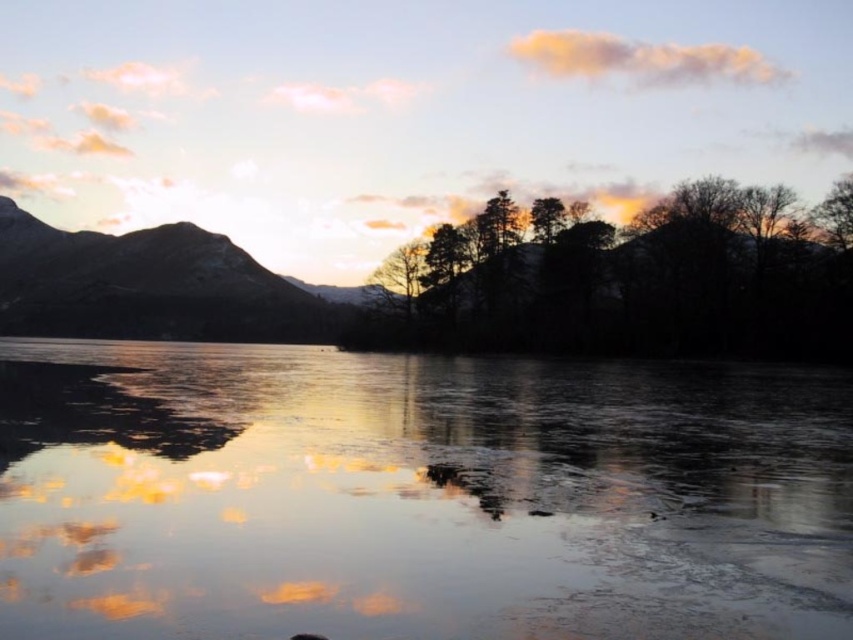
Question: Which of the following is the farthest from the observer?

Choices:
 (A) (845, 355)
 (B) (827, 212)
 (C) (53, 276)
 (D) (679, 572)

Answer: (C)

Question: In this image, where is silhouette trees at center located relative to fuzzy orange cloud at upper center?

Choices:
 (A) left
 (B) right

Answer: (A)

Question: Which point appears closest to the camera in this image?

Choices:
 (A) (659, 209)
 (B) (849, 176)

Answer: (B)

Question: Can you confirm if smooth brown mountain at left is positioned above green leafy tree at upper right?

Choices:
 (A) yes
 (B) no

Answer: (A)

Question: Which object is the farthest from the silhouette trees at center?

Choices:
 (A) fuzzy orange cloud at upper center
 (B) smooth brown mountain at left
 (C) green leafy tree at upper right

Answer: (A)

Question: Does fuzzy orange cloud at upper center appear under green leafy tree at upper right?

Choices:
 (A) yes
 (B) no

Answer: (B)